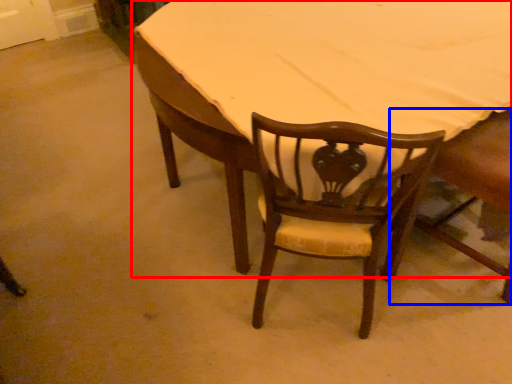
Question: Which point is further to the camera, table (highlighted by a red box) or chair (highlighted by a blue box)?

Choices:
 (A) table
 (B) chair

Answer: (A)